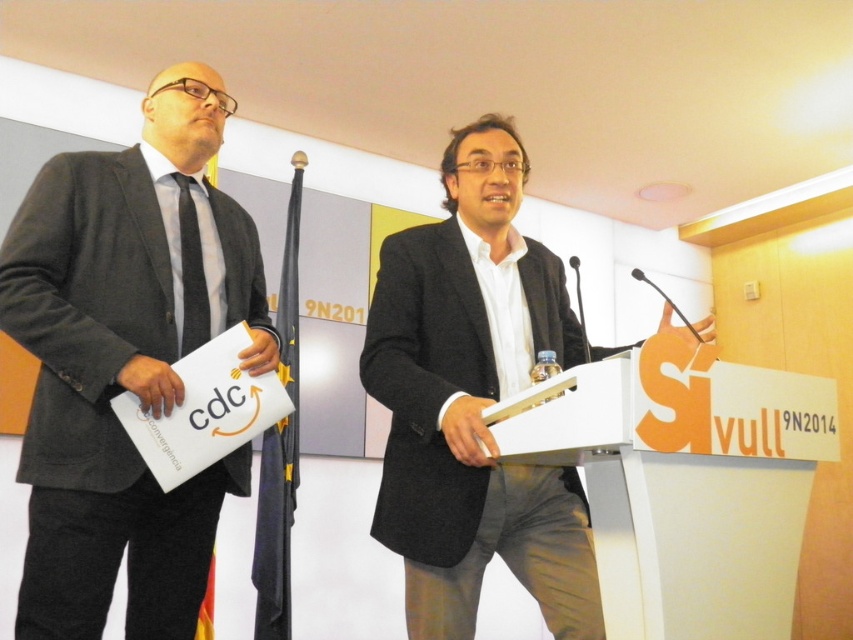
Question: Can you confirm if dark gray wool coat at center is positioned below black striped tie at left?

Choices:
 (A) no
 (B) yes

Answer: (B)

Question: Does dark gray wool coat at center have a larger size compared to white plastic podium at center?

Choices:
 (A) no
 (B) yes

Answer: (B)

Question: Observing the image, what is the correct spatial positioning of dark gray wool coat at center in reference to black striped tie at left?

Choices:
 (A) left
 (B) right

Answer: (B)

Question: Which object appears farthest from the camera in this image?

Choices:
 (A) dark gray wool coat at center
 (B) matte black suit at left
 (C) white plastic podium at center
 (D) black striped tie at left

Answer: (D)

Question: Estimate the real-world distances between objects in this image. Which object is farther from the white plastic podium at center?

Choices:
 (A) dark gray wool coat at center
 (B) matte black suit at left
 (C) black striped tie at left

Answer: (C)

Question: Which object is farther from the camera taking this photo?

Choices:
 (A) dark gray wool coat at center
 (B) white plastic podium at center
 (C) black striped tie at left

Answer: (C)